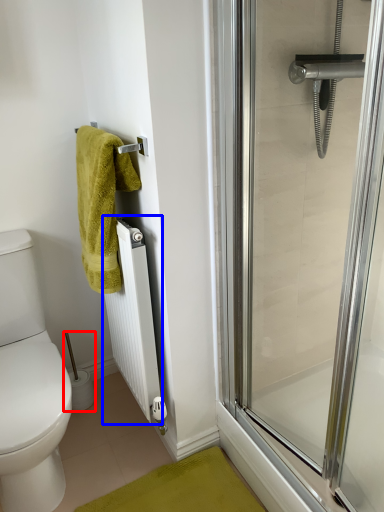
Question: Which object appears closest to the camera in this image, toilet paper (highlighted by a red box) or radiator (highlighted by a blue box)?

Choices:
 (A) toilet paper
 (B) radiator

Answer: (B)